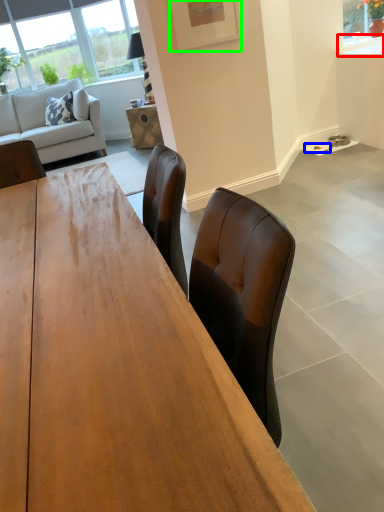
Question: Which is nearer to the counter top (highlighted by a red box)? plate (highlighted by a blue box) or picture frame (highlighted by a green box).

Choices:
 (A) plate
 (B) picture frame

Answer: (A)